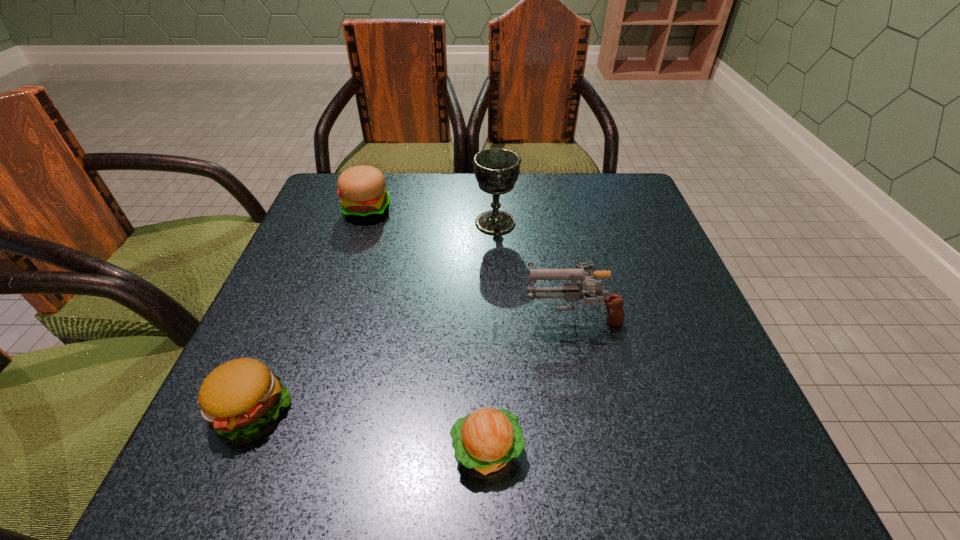
Where is `the tallest object`? The image size is (960, 540). the tallest object is located at coordinates (496, 170).

At what (x,y) coordinates should I click in order to perform the action: click on the third nearest object. Please return your answer as a coordinate pair (x, y). Image resolution: width=960 pixels, height=540 pixels. Looking at the image, I should click on (571, 293).

This screenshot has width=960, height=540. I want to click on the fourth shortest object, so click(571, 293).

Identify the location of the tallest hamburger. This screenshot has height=540, width=960. (362, 189).

I want to click on the farthest hamburger, so click(x=362, y=189).

The height and width of the screenshot is (540, 960). Find the location of `the rightmost hamburger`. the rightmost hamburger is located at coordinates (486, 440).

This screenshot has width=960, height=540. I want to click on vacant position located 0.300m on the front of the chalice, so click(500, 342).

Where is `free location located 0.310m at the barrel end of the fourth shortest object`? This screenshot has height=540, width=960. free location located 0.310m at the barrel end of the fourth shortest object is located at coordinates (355, 316).

Where is `blank space located at the barrel end of the fourth shortest object`? The height and width of the screenshot is (540, 960). blank space located at the barrel end of the fourth shortest object is located at coordinates click(x=398, y=316).

You are a GUI agent. You are given a task and a screenshot of the screen. Output one action in this format:
    pyautogui.click(x=<x>, y=<y>)
    Task: Click on the blank space located 0.370m at the barrel end of the fourth shortest object
    This screenshot has height=540, width=960.
    Given the screenshot: What is the action you would take?
    pyautogui.click(x=323, y=316)